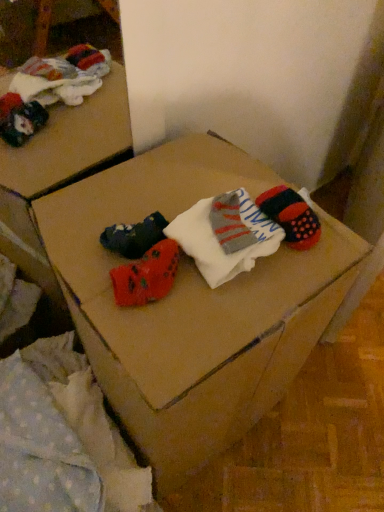
The image size is (384, 512). What are the coordinates of `light blue polka dot fabric at lower left` in the screenshot? It's located at (62, 437).

At what (x,y) coordinates should I click in order to perform the action: click on cardboard box at center. Please return your answer as a coordinate pair (x, y). Looking at the image, I should click on (191, 306).

Locate an element on the screen. bedding that appears below the white soft socks at center (from the image's perspective) is located at coordinates (62, 437).

Between light blue polka dot fabric at lower left and white soft socks at center, which one is positioned in front?

light blue polka dot fabric at lower left.

Is light blue polka dot fabric at lower left bigger than white soft socks at center?

Correct, light blue polka dot fabric at lower left is larger in size than white soft socks at center.

Is light blue polka dot fabric at lower left not close to cardboard box at center?

light blue polka dot fabric at lower left is near cardboard box at center, not far away.

Image resolution: width=384 pixels, height=512 pixels. In order to click on furniture on the right of the light blue polka dot fabric at lower left in this screenshot , I will do `click(191, 306)`.

Which is in front, point (73, 493) or point (98, 281)?

The point (98, 281) is in front.

Which of these two, white soft socks at center or light blue polka dot fabric at lower left, is smaller?

white soft socks at center is smaller.

From a real-world perspective, does white soft socks at center stand above light blue polka dot fabric at lower left?

Yes, from a real-world perspective, white soft socks at center is on top of light blue polka dot fabric at lower left.

Would you say light blue polka dot fabric at lower left is part of white soft socks at center's contents?

No, light blue polka dot fabric at lower left is not a part of white soft socks at center.

In terms of size, does white soft socks at center appear bigger or smaller than cardboard box at center?

Considering their sizes, white soft socks at center takes up less space than cardboard box at center.

Considering their positions, is white soft socks at center located in front of or behind cardboard box at center?

Visually, white soft socks at center is located behind cardboard box at center.

At what (x,y) coordinates should I click in order to perform the action: click on furniture in front of the white soft socks at center. Please return your answer as a coordinate pair (x, y). Looking at the image, I should click on (191, 306).

Is cardboard box at center positioned with its back to light blue polka dot fabric at lower left?

No, cardboard box at center's orientation is not away from light blue polka dot fabric at lower left.

From a real-world perspective, does cardboard box at center stand above light blue polka dot fabric at lower left?

Yes, from a real-world perspective, cardboard box at center is on top of light blue polka dot fabric at lower left.

Does cardboard box at center touch light blue polka dot fabric at lower left?

They are not placed beside each other.

Does cardboard box at center come in front of light blue polka dot fabric at lower left?

Yes, it is.

Considering the relative sizes of cardboard box at center and white soft socks at center in the image provided, is cardboard box at center bigger than white soft socks at center?

Yes.

How many degrees apart are the facing directions of cardboard box at center and white soft socks at center?

2.89 degrees separate the facing orientations of cardboard box at center and white soft socks at center.

Is cardboard box at center to the left or to the right of white soft socks at center in the image?

cardboard box at center is positioned on white soft socks at center's left side.

This screenshot has width=384, height=512. Identify the location of sock above the light blue polka dot fabric at lower left (from a real-world perspective). (225, 234).

Where is `furniture above the light blue polka dot fabric at lower left (from the image's perspective)`? Image resolution: width=384 pixels, height=512 pixels. furniture above the light blue polka dot fabric at lower left (from the image's perspective) is located at coordinates (191, 306).

Based on their spatial positions, is white soft socks at center or light blue polka dot fabric at lower left closer to cardboard box at center?

Among the two, white soft socks at center is located nearer to cardboard box at center.

Based on their spatial positions, is cardboard box at center or light blue polka dot fabric at lower left further from white soft socks at center?

The object further to white soft socks at center is light blue polka dot fabric at lower left.

Which object lies nearer to the anchor point white soft socks at center, light blue polka dot fabric at lower left or cardboard box at center?

cardboard box at center is positioned closer to the anchor white soft socks at center.

Considering their positions, is light blue polka dot fabric at lower left positioned further to cardboard box at center than white soft socks at center?

The object further to cardboard box at center is light blue polka dot fabric at lower left.

When comparing their distances from light blue polka dot fabric at lower left, does cardboard box at center or white soft socks at center seem closer?

cardboard box at center.

Estimate the real-world distances between objects in this image. Which object is further from light blue polka dot fabric at lower left, white soft socks at center or cardboard box at center?

white soft socks at center.

This screenshot has height=512, width=384. I want to click on furniture between white soft socks at center and light blue polka dot fabric at lower left in the vertical direction, so click(x=191, y=306).